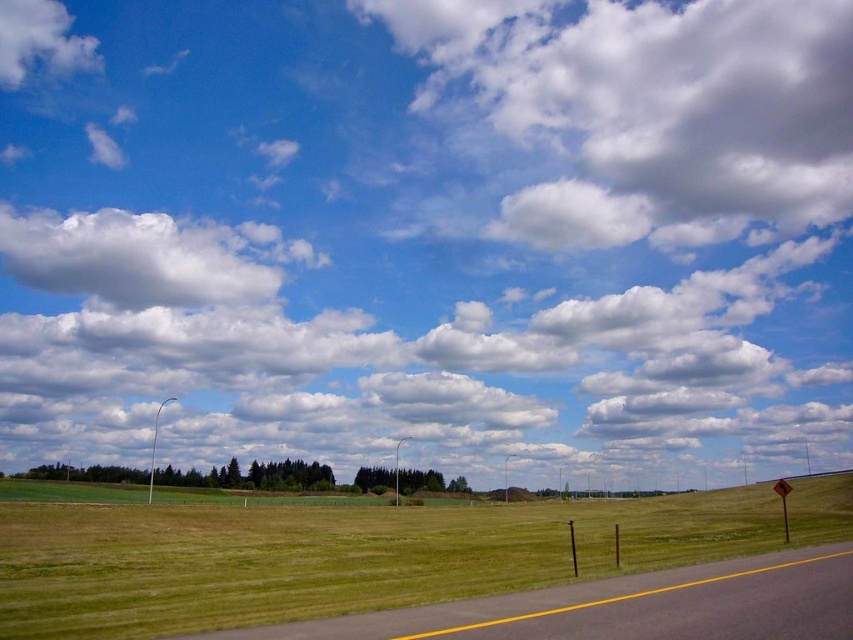
Looking at this image, is white fluffy cloud at upper center taller than green grass at lower center?

Indeed, white fluffy cloud at upper center has a greater height compared to green grass at lower center.

Does white fluffy cloud at upper center lie in front of green grass at lower center?

No, it is behind green grass at lower center.

Which is in front, point (589, 113) or point (682, 554)?

Point (682, 554)

Locate an element on the screen. white fluffy cloud at upper center is located at coordinates (653, 112).

Is white fluffy cloud at upper center smaller than gray asphalt highway at lower center?

No.

Between point (637, 51) and point (711, 588), which one is positioned in front?

Positioned in front is point (711, 588).

Locate an element on the screen. This screenshot has height=640, width=853. white fluffy cloud at upper center is located at coordinates (653, 112).

Does green grass at lower center have a greater width compared to gray asphalt highway at lower center?

Correct, the width of green grass at lower center exceeds that of gray asphalt highway at lower center.

Is green grass at lower center shorter than gray asphalt highway at lower center?

In fact, green grass at lower center may be taller than gray asphalt highway at lower center.

Is point (817, 484) behind point (537, 600)?

Yes, point (817, 484) is behind point (537, 600).

Locate an element on the screen. Image resolution: width=853 pixels, height=640 pixels. green grass at lower center is located at coordinates (357, 554).